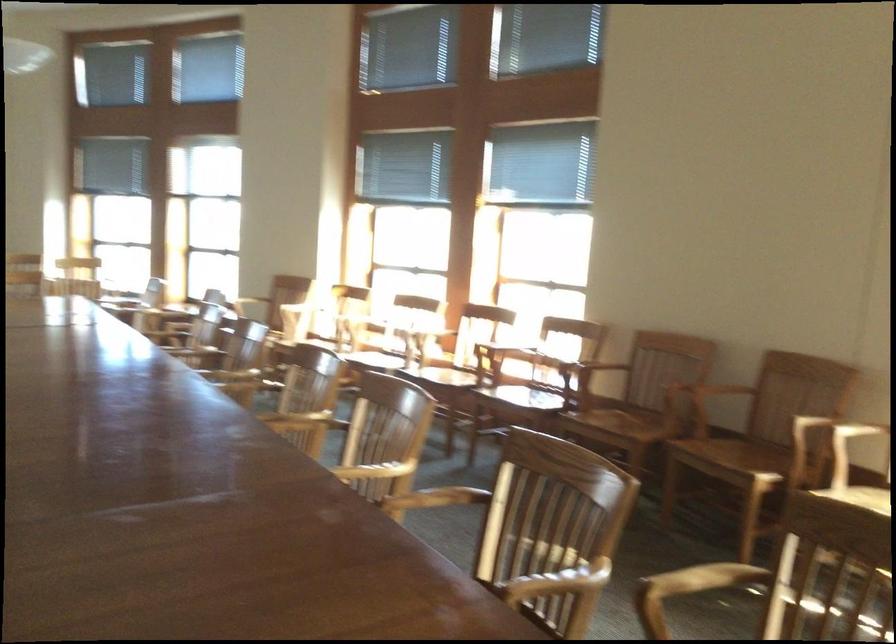
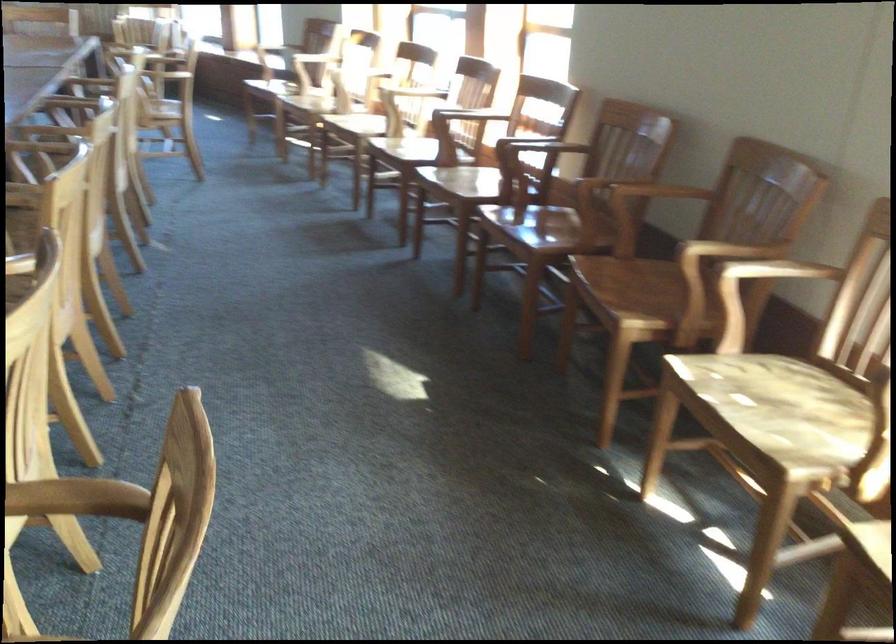
The point at (746,442) is marked in the first image. Where is the corresponding point in the second image?

(650, 283)